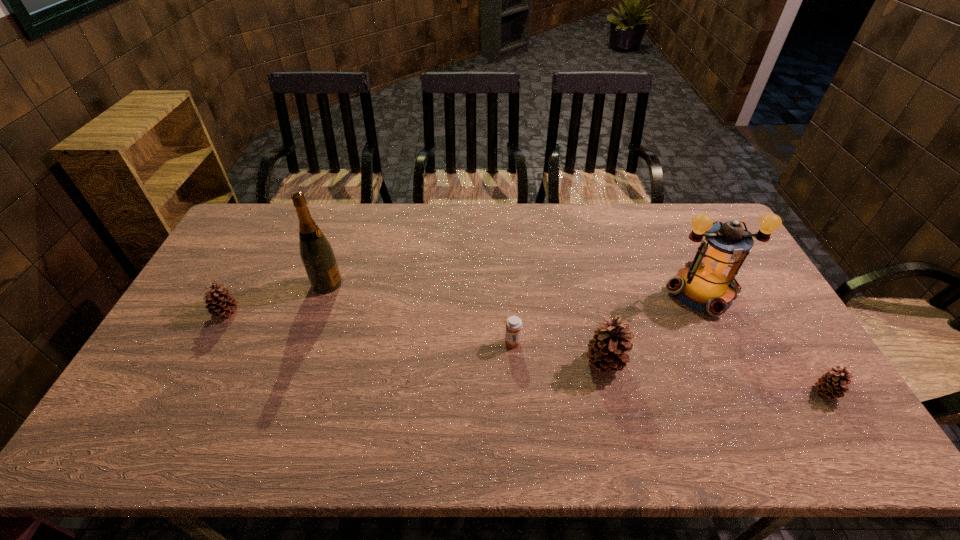
Locate an element on the screen. the leftmost object is located at coordinates (220, 303).

Where is `the farthest pinecone`? the farthest pinecone is located at coordinates (220, 303).

This screenshot has width=960, height=540. Identify the location of the tallest pinecone. (606, 350).

At what (x,y) coordinates should I click in order to perform the action: click on the third object from right to left. Please return your answer as a coordinate pair (x, y). Looking at the image, I should click on (606, 350).

Find the location of a particular element. the rightmost object is located at coordinates (831, 384).

Identify the location of the rightmost pinecone. The image size is (960, 540). (831, 384).

Where is `the second object from right to left`? The width and height of the screenshot is (960, 540). the second object from right to left is located at coordinates (707, 284).

I want to click on the second tallest object, so click(x=707, y=284).

You are a GUI agent. You are given a task and a screenshot of the screen. Output one action in this format:
    pyautogui.click(x=<x>, y=<y>)
    Task: Click on the wine bottle
    Image resolution: width=960 pixels, height=540 pixels.
    Given the screenshot: What is the action you would take?
    pyautogui.click(x=317, y=255)

Where is `medicine`? medicine is located at coordinates (513, 324).